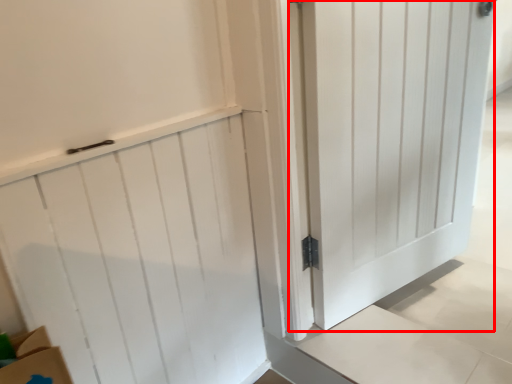
Question: From the image's perspective, where is door (annotated by the red box) located relative to door?

Choices:
 (A) below
 (B) above

Answer: (B)